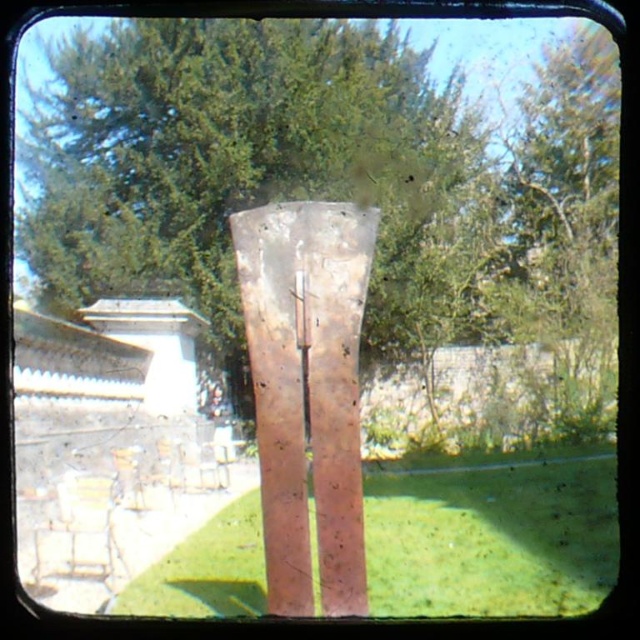
From the picture: You are standing in front of the metal sculpture and want to take a photo that includes both point (372, 472) and point (294, 237). Which point will appear closer to the bottom of the photo?

Point (294, 237) will appear closer to the bottom of the photo because it is closer to the camera than point (372, 472).

You are standing in the outdoor area and want to walk from the white building on the left to the green grass at center. Which direction should you move relative to the rusty metal sculpture at center?

To reach the green grass at center from the white building on the left, you should move to the right of the rusty metal sculpture at center since the green grass at center is located to the right of it.